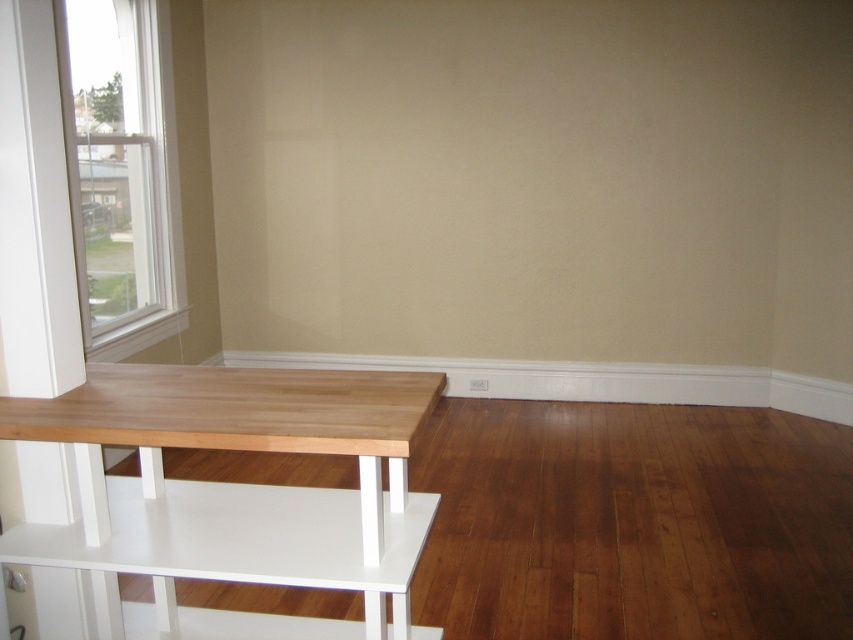
You are moving a small potted plant that is 1.2 meters tall. You want to place it on the light wood table at left or the white plastic window at upper left. Based on their heights, which surface can safely accommodate the plant without it exceeding the surface height?

The light wood table at left is shorter than the white plastic window at upper left, so the plant should be placed on the white plastic window at upper left to ensure it doesn not exceed the surface height.

You are standing in the room and want to move from the white plastic window at upper left to the light wood table at left. Which direction should you move in?

You should move to the right to reach the light wood table at left from the white plastic window at upper left since the light wood table at left is positioned to the right of the white plastic window at upper left.

From the picture: You are planning to place a new decorative item on the light wood table at left. Considering the size of the white plastic window at upper left, can you determine if the table is large enough to accommodate a medium sized decorative item?

The light wood table at left has a smaller size compared to the white plastic window at upper left. Since the table is smaller, it may not have enough space for a medium sized decorative item. Please consider a smaller item or a different surface.